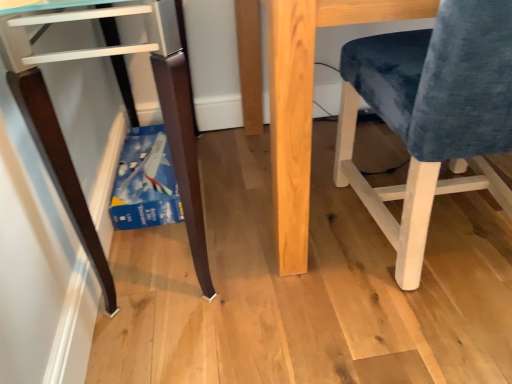
Question: Is natural wood table at center with velvet blue chair at right?

Choices:
 (A) no
 (B) yes

Answer: (A)

Question: Is velvet blue chair at right at the back of natural wood table at center?

Choices:
 (A) no
 (B) yes

Answer: (A)

Question: From the image's perspective, is natural wood table at center on velvet blue chair at right?

Choices:
 (A) no
 (B) yes

Answer: (B)

Question: Are natural wood table at center and velvet blue chair at right located far from each other?

Choices:
 (A) no
 (B) yes

Answer: (A)

Question: Does natural wood table at center come behind velvet blue chair at right?

Choices:
 (A) no
 (B) yes

Answer: (B)

Question: Is natural wood table at center to the left of velvet blue chair at right from the viewer's perspective?

Choices:
 (A) no
 (B) yes

Answer: (B)

Question: From the image's perspective, is matte dark wood desk at lower left on velvet blue chair at right?

Choices:
 (A) yes
 (B) no

Answer: (A)

Question: Does matte dark wood desk at lower left have a greater height compared to velvet blue chair at right?

Choices:
 (A) no
 (B) yes

Answer: (B)

Question: Is matte dark wood desk at lower left turned away from velvet blue chair at right?

Choices:
 (A) no
 (B) yes

Answer: (A)

Question: Is matte dark wood desk at lower left at the right side of velvet blue chair at right?

Choices:
 (A) yes
 (B) no

Answer: (B)

Question: Does matte dark wood desk at lower left have a greater width compared to velvet blue chair at right?

Choices:
 (A) yes
 (B) no

Answer: (B)

Question: Is matte dark wood desk at lower left in front of velvet blue chair at right?

Choices:
 (A) no
 (B) yes

Answer: (A)

Question: Does natural wood table at center have a larger size compared to matte dark wood desk at lower left?

Choices:
 (A) yes
 (B) no

Answer: (A)